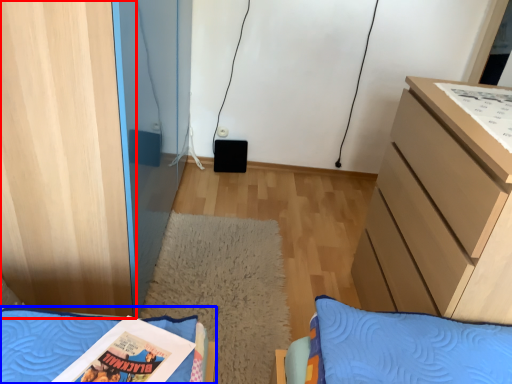
Question: Which of the following is the farthest to the observer, cabinetry (highlighted by a red box) or furniture (highlighted by a blue box)?

Choices:
 (A) cabinetry
 (B) furniture

Answer: (A)